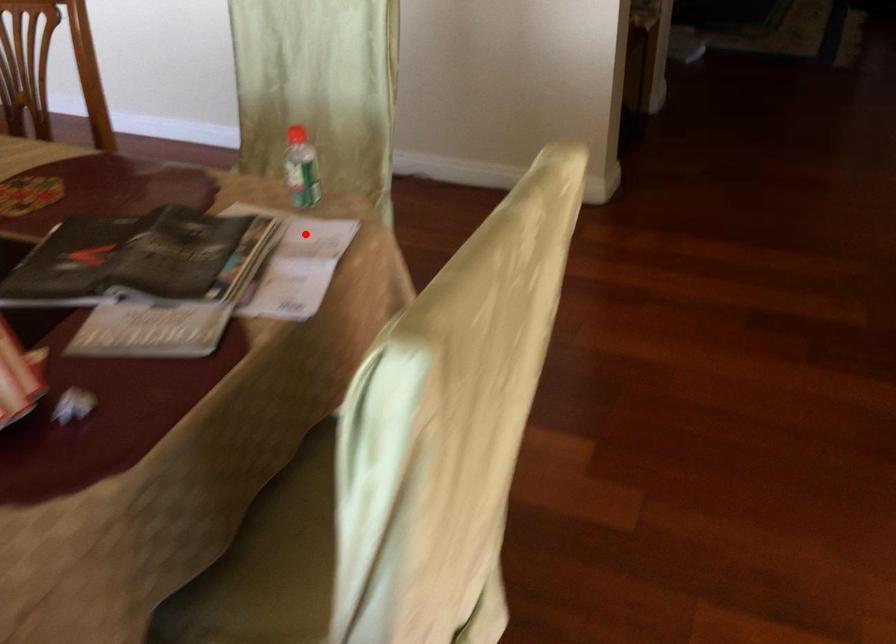
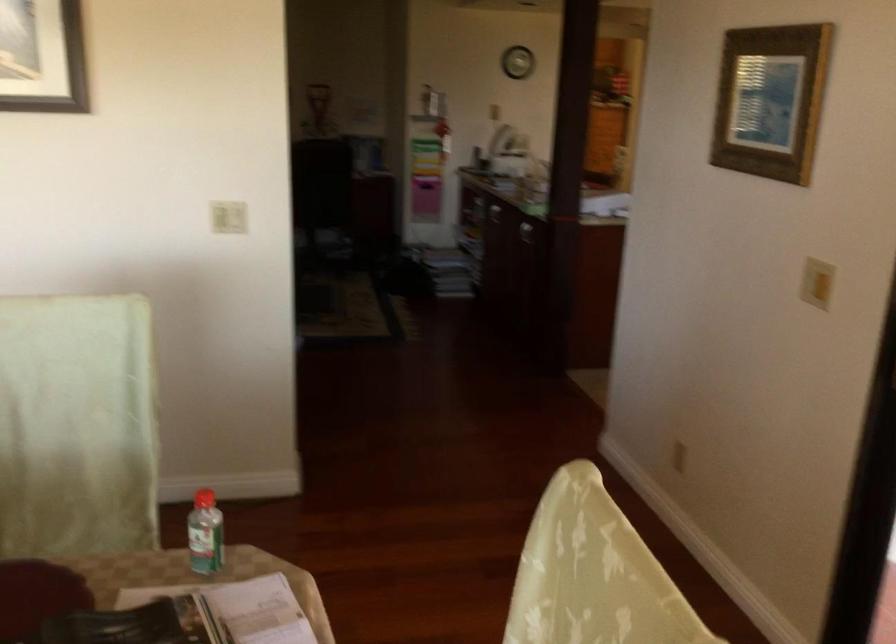
The point at the highlighted location is marked in the first image. Where is the corresponding point in the second image?

(238, 609)